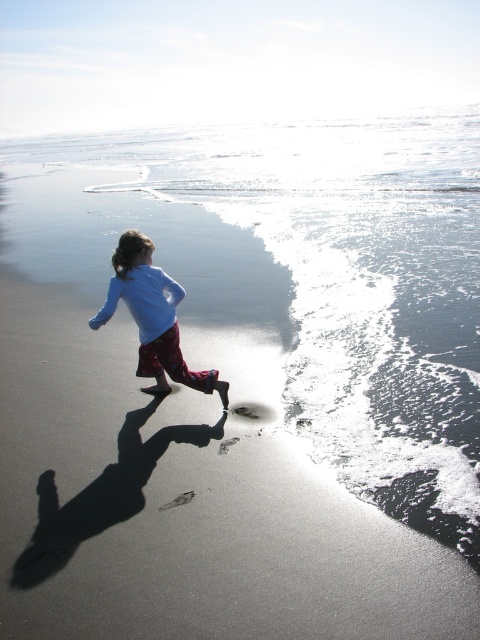
What are the coordinates of the sandy beach at lower left in the image?

The coordinates of the sandy beach at lower left are at point (177, 451).

You are standing on the sandy beach at lower left and want to reach the light blue fabric shirt at center. Which direction should you move to get closer to the shirt?

The sandy beach at lower left is above the light blue fabric shirt at center, so you should move downward to reach the shirt.